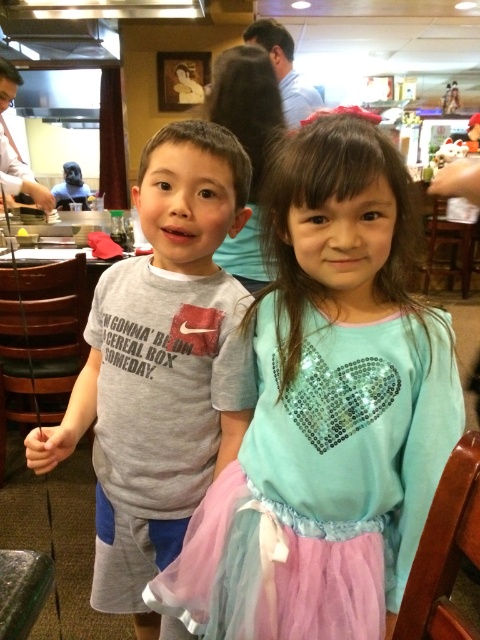
You are a photographer trying to capture the gray cotton shirt at center in the image. Given that the camera is focused on the point at coordinates point (162, 368), will the gray cotton shirt at center be in focus?

The point (162, 368) indicates the gray cotton shirt at center, so yes, the gray cotton shirt at center will be in focus since the camera is focused on that point.

You are a photographer trying to capture a photo of both children in the restaurant scene. You notice two points marked in the image. The first point is at coordinates point (231, 180) and the second is at point (147, 547). Which point is closer to the camera?

Point (231, 180) is in front of point (147, 547), so it is closer to the camera.